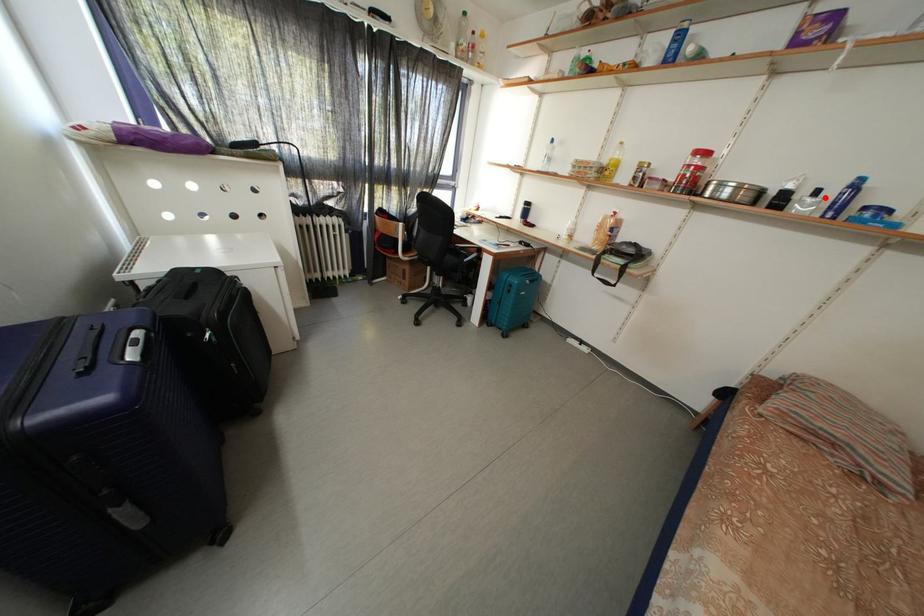
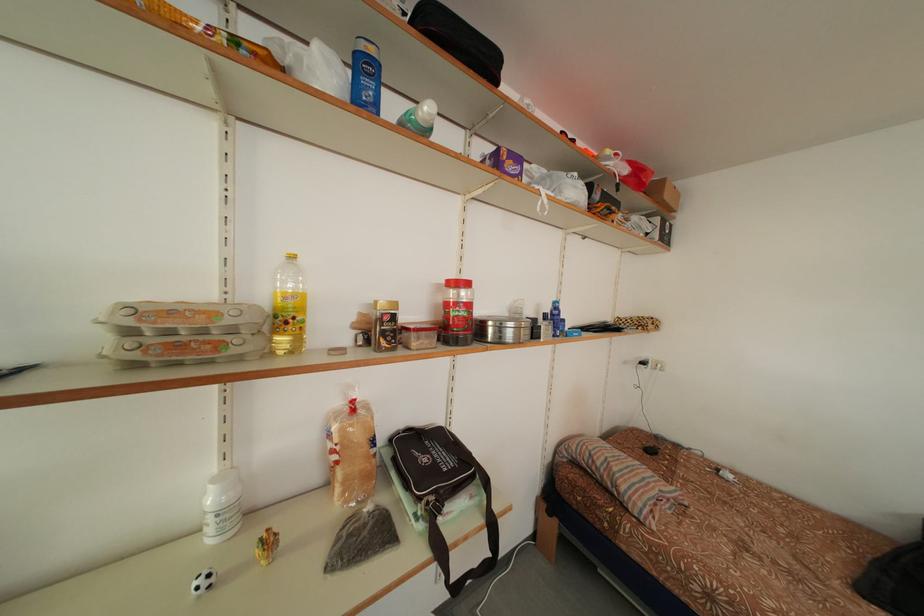
In the second image, find the point that corresponds to the highlighted location in the first image.

(553, 322)